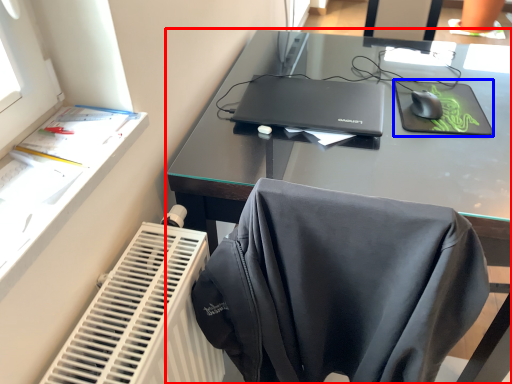
Question: Which object appears closest to the camera in this image, desk (highlighted by a red box) or mousepad (highlighted by a blue box)?

Choices:
 (A) desk
 (B) mousepad

Answer: (A)